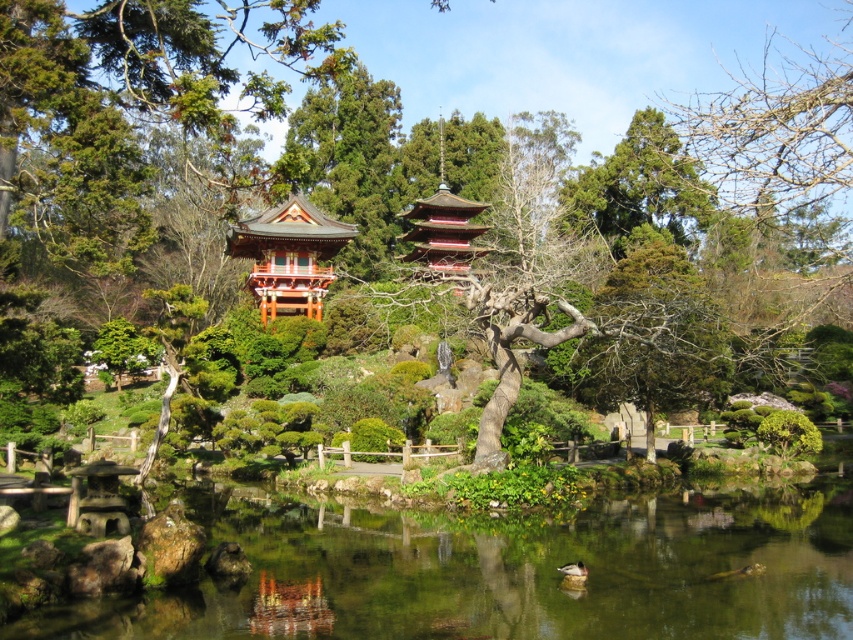
Does clear water at center have a lesser height compared to shiny red pagoda at center?

Yes.

Does point (370, 628) come farther from viewer compared to point (299, 257)?

That is False.

Which is in front, point (508, 561) or point (241, 227)?

Positioned in front is point (508, 561).

Identify the location of clear water at center. (505, 572).